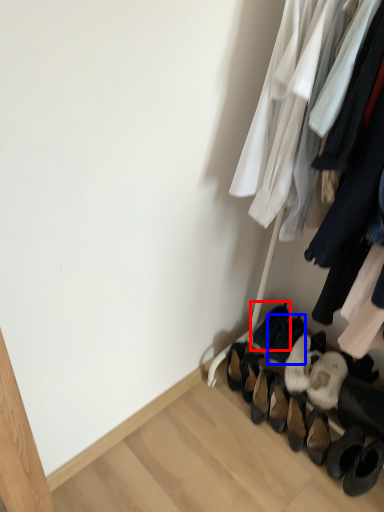
Question: Which point is closer to the camera, footwear (highlighted by a red box) or footwear (highlighted by a blue box)?

Choices:
 (A) footwear
 (B) footwear

Answer: (B)